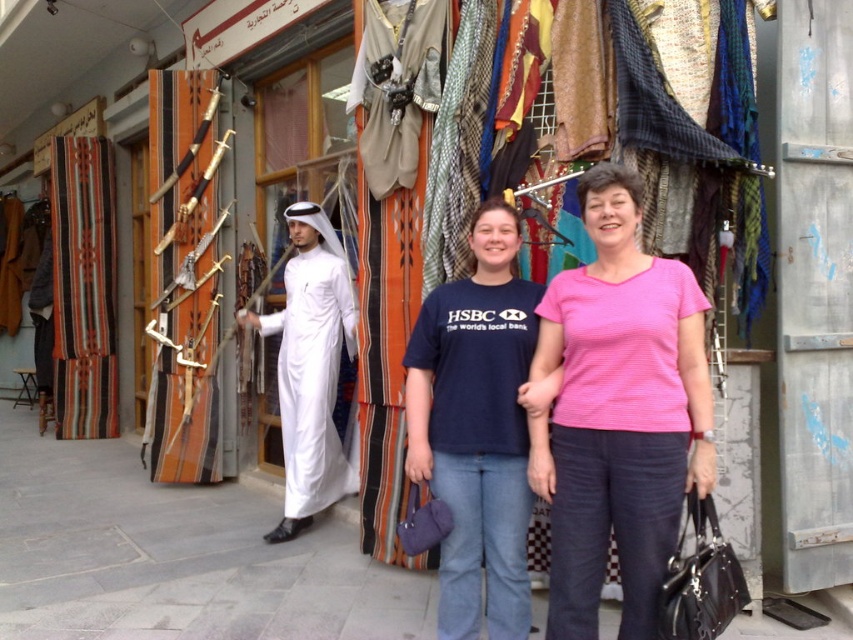
Question: Estimate the real-world distances between objects in this image. Which object is farther from the pink fabric at center?

Choices:
 (A) white cotton robe at center
 (B) blue cotton t-shirt at center

Answer: (A)

Question: Which of the following is the farthest from the observer?

Choices:
 (A) white cotton robe at center
 (B) pink fabric at center
 (C) blue cotton t-shirt at center

Answer: (A)

Question: From the image, what is the correct spatial relationship of pink fabric at center in relation to white cotton robe at center?

Choices:
 (A) below
 (B) above

Answer: (B)

Question: Is blue cotton t-shirt at center behind white cotton robe at center?

Choices:
 (A) no
 (B) yes

Answer: (A)

Question: Does blue cotton t-shirt at center come in front of white cotton robe at center?

Choices:
 (A) no
 (B) yes

Answer: (B)

Question: Which object is positioned closest to the pink fabric at center?

Choices:
 (A) white cotton robe at center
 (B) blue cotton t-shirt at center

Answer: (B)